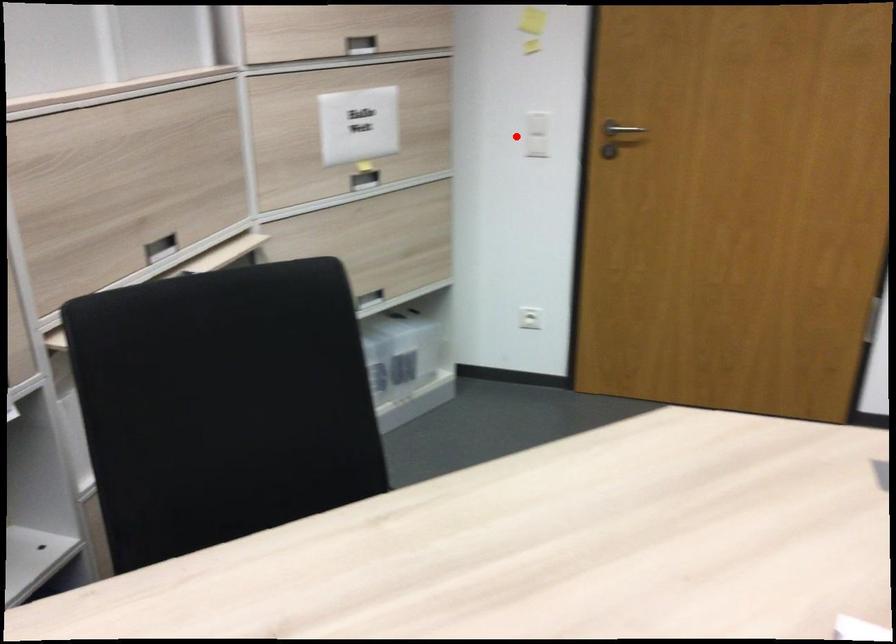
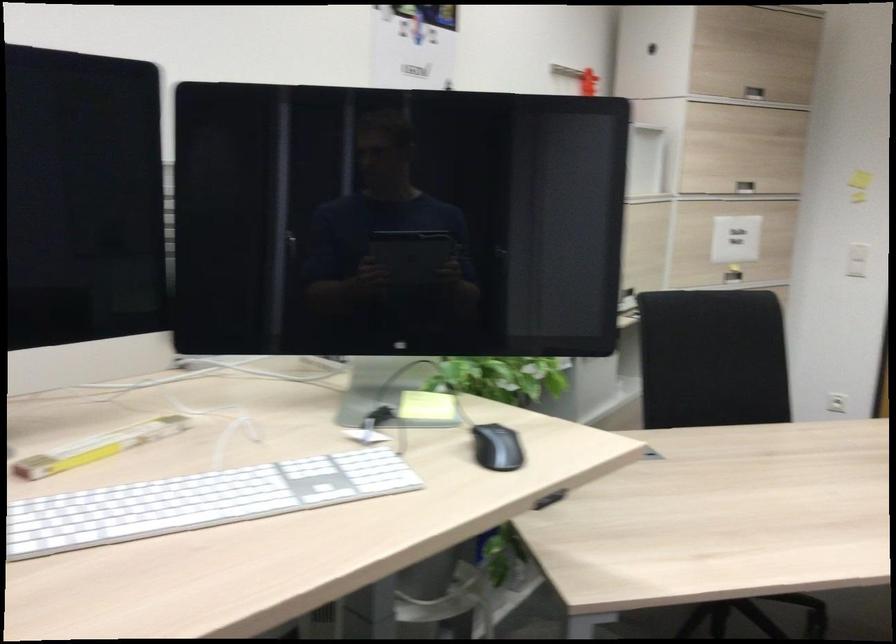
Question: I am providing you with two images of the same scene from different viewpoints. Given a red point in image1, look at the same physical point in image2. Is it:

Choices:
 (A) Closer to the viewpoint
 (B) Farther from the viewpoint

Answer: (B)